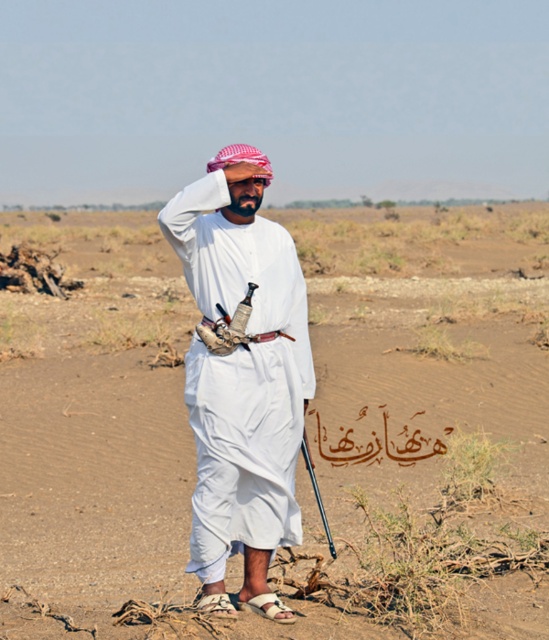
Does brown sandy dirt field at center have a larger size compared to white matte clothing at center?

Correct, brown sandy dirt field at center is larger in size than white matte clothing at center.

Locate an element on the screen. The width and height of the screenshot is (549, 640). brown sandy dirt field at center is located at coordinates (305, 426).

The height and width of the screenshot is (640, 549). Identify the location of brown sandy dirt field at center. (305, 426).